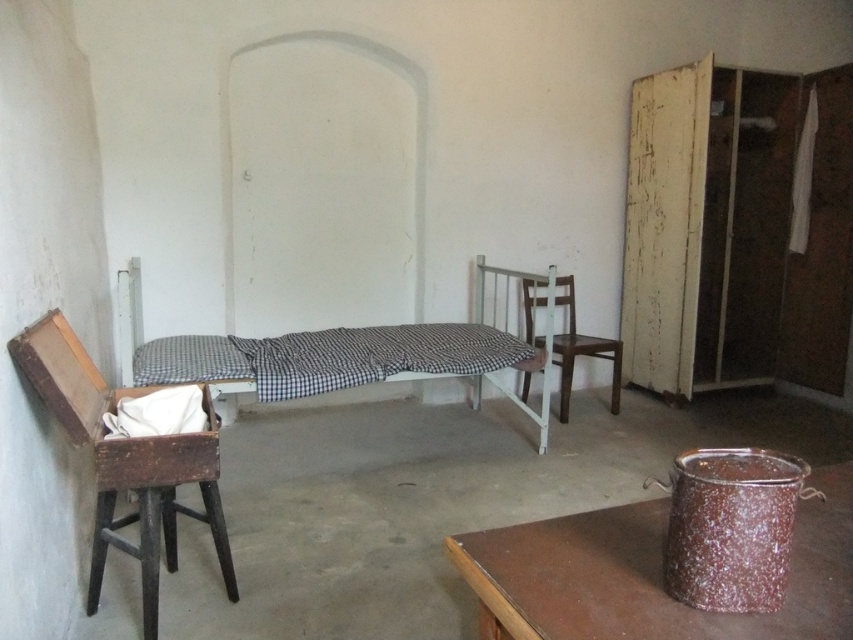
Does point (144, 360) come behind point (570, 365)?

No, (144, 360) is in front of (570, 365).

Consider the image. Can you confirm if white cotton pillow at center is taller than wooden chair at center?

No, white cotton pillow at center is not taller than wooden chair at center.

The image size is (853, 640). What do you see at coordinates (189, 360) in the screenshot?
I see `white cotton pillow at center` at bounding box center [189, 360].

Where is `white cotton pillow at center`? white cotton pillow at center is located at coordinates (189, 360).

Does brown wooden table at lower right appear over wooden chair at center?

No.

Between brown wooden table at lower right and wooden chair at center, which one has more height?

With more height is wooden chair at center.

Is point (503, 618) positioned before point (552, 348)?

Yes.

I want to click on brown wooden table at lower right, so click(648, 576).

Between checkered fabric bed at center and wooden chair at center, which one is positioned lower?

wooden chair at center is below.

Does checkered fabric bed at center have a greater height compared to wooden chair at center?

Yes.

Where is `checkered fabric bed at center`? The image size is (853, 640). checkered fabric bed at center is located at coordinates (351, 355).